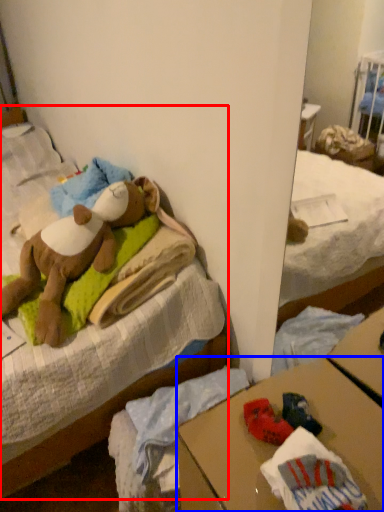
Question: Which of the following is the closest to the observer, bed (highlighted by a red box) or desk (highlighted by a blue box)?

Choices:
 (A) bed
 (B) desk

Answer: (B)